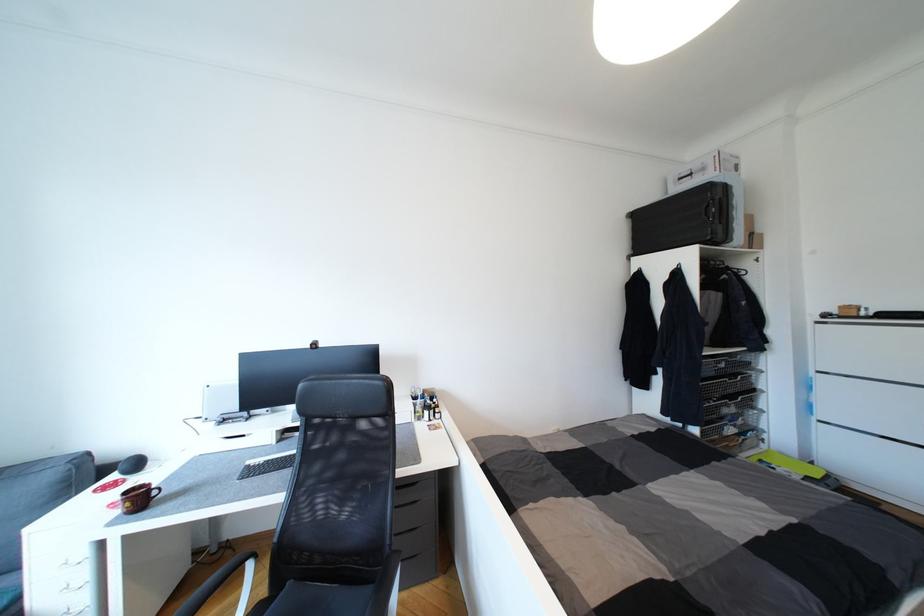
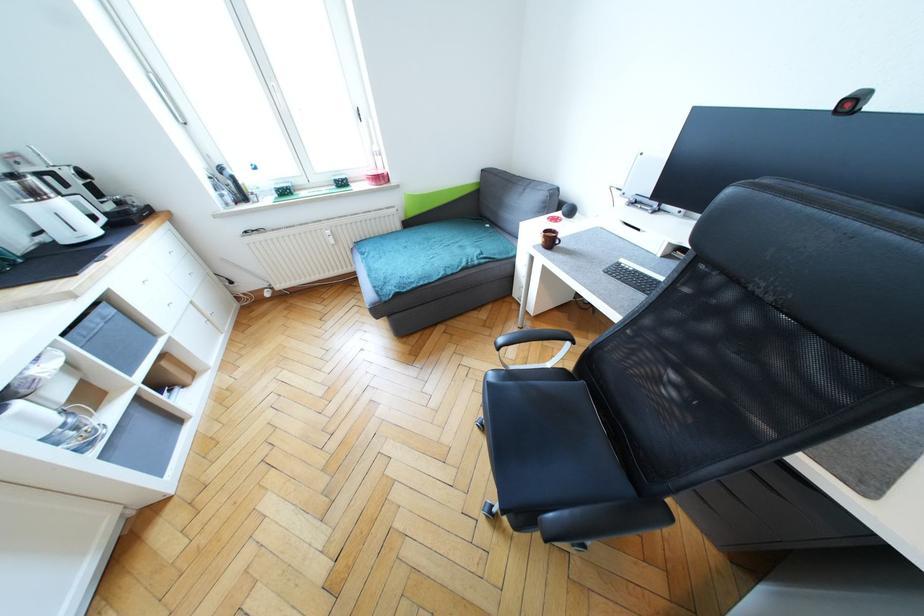
First-person continuous shooting, in which direction is the camera rotating?

The rotation direction of the camera is left-down.